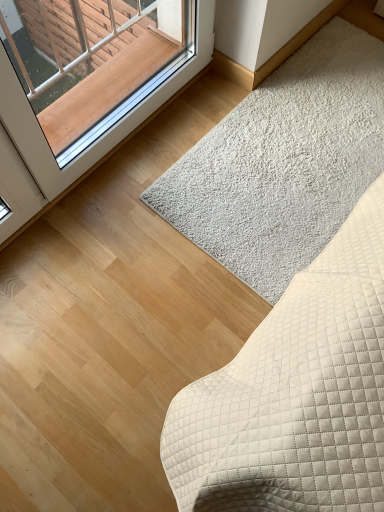
Image resolution: width=384 pixels, height=512 pixels. I want to click on free space to the left of white shaggy rug at center, so click(x=134, y=191).